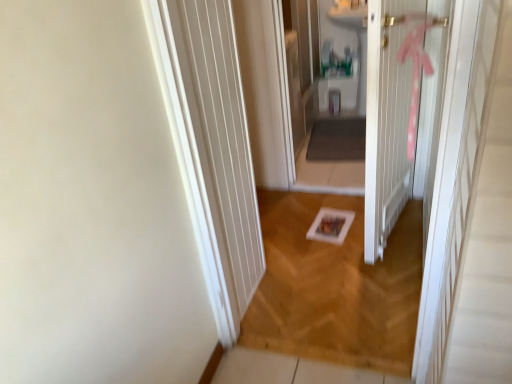
This screenshot has height=384, width=512. Find the location of `matte white sink at center`. matte white sink at center is located at coordinates (320, 94).

The image size is (512, 384). I want to click on white wooden door at center, so click(395, 108).

Describe the element at coordinates (395, 108) in the screenshot. I see `white wooden door at center` at that location.

Where is `matte white sink at center`? This screenshot has height=384, width=512. matte white sink at center is located at coordinates (320, 94).

Based on the photo, measure the distance from wooden frame at center to matte white sink at center.

wooden frame at center is 3.45 feet away from matte white sink at center.

Are wooden frame at center and matte white sink at center beside each other?

No.

Can you confirm if wooden frame at center is smaller than matte white sink at center?

Correct, wooden frame at center occupies less space than matte white sink at center.

Is wooden frame at center taller or shorter than matte white sink at center?

In the image, wooden frame at center appears to be shorter than matte white sink at center.

Considering the sizes of objects wooden frame at center and white wooden door at center in the image provided, who is taller, wooden frame at center or white wooden door at center?

white wooden door at center.

Would you consider wooden frame at center to be distant from white wooden door at center?

No.

Is wooden frame at center at the left side of white wooden door at center?

Yes, wooden frame at center is to the left of white wooden door at center.

From a real-world perspective, which object rests below the other?

wooden frame at center is physically lower.

From a real-world perspective, which object stands above the other?

white wooden door at center is physically above.

Between white wooden door at center and wooden frame at center, which one is positioned behind?

wooden frame at center is further away from the camera.

How different are the orientations of white wooden door at center and wooden frame at center in degrees?

102 degrees.

How much distance is there between white wooden door at center and matte white sink at center?

98.63 centimeters.

Can you confirm if white wooden door at center is taller than matte white sink at center?

Yes, white wooden door at center is taller than matte white sink at center.

Between white wooden door at center and matte white sink at center, which one has larger size?

white wooden door at center.

Which is behind, point (370, 70) or point (300, 3)?

The point (300, 3) is more distant.

Which object is more forward, matte white sink at center or wooden frame at center?

wooden frame at center.

In order to click on plain that appears below the matte white sink at center (from a real-world perspective) in this screenshot , I will do `click(335, 287)`.

From the image's perspective, between matte white sink at center and wooden frame at center, who is located below?

From the image's view, wooden frame at center is below.

How far apart are matte white sink at center and wooden frame at center?

matte white sink at center is 1.05 meters away from wooden frame at center.

From a real-world perspective, who is located higher, matte white sink at center or white wooden door at center?

From a 3D spatial view, white wooden door at center is above.

In the scene shown: Who is more distant, matte white sink at center or white wooden door at center?

Positioned behind is matte white sink at center.

Could you tell me if matte white sink at center is facing white wooden door at center?

No, matte white sink at center is not oriented towards white wooden door at center.

What's the angular difference between matte white sink at center and white wooden door at center's facing directions?

The facing directions of matte white sink at center and white wooden door at center are 103 degrees apart.

Image resolution: width=512 pixels, height=384 pixels. Identify the location of corridor located above the wooden frame at center (from the image's perspective). (320, 94).

There is a wooden frame at center. In order to click on door above it (from a real-world perspective) in this screenshot , I will do `click(395, 108)`.

Estimate the real-world distances between objects in this image. Which object is further from matte white sink at center, white wooden door at center or wooden frame at center?

The object further to matte white sink at center is wooden frame at center.

Based on their spatial positions, is matte white sink at center or wooden frame at center closer to white wooden door at center?

wooden frame at center is closer to white wooden door at center.

Based on their spatial positions, is wooden frame at center or white wooden door at center closer to matte white sink at center?

white wooden door at center is positioned closer to the anchor matte white sink at center.

Considering their positions, is matte white sink at center positioned closer to wooden frame at center than white wooden door at center?

white wooden door at center is closer to wooden frame at center.

Looking at the image, which one is located further to wooden frame at center, white wooden door at center or matte white sink at center?

matte white sink at center is further to wooden frame at center.

Considering their positions, is wooden frame at center positioned closer to white wooden door at center than matte white sink at center?

wooden frame at center.

Locate an element on the screen. door that lies between matte white sink at center and wooden frame at center from top to bottom is located at coordinates (395, 108).